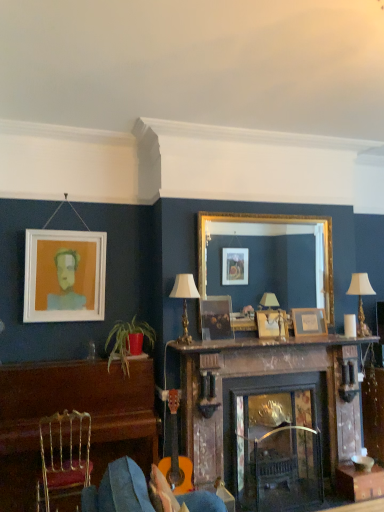
The image size is (384, 512). What do you see at coordinates (270, 223) in the screenshot?
I see `gold-framed mirror at center` at bounding box center [270, 223].

Describe the element at coordinates (184, 301) in the screenshot. I see `gold metallic table lamp at center, the second lamp from the right` at that location.

Locate an element on the screen. The image size is (384, 512). matte white picture frame at left, the first picture frame when ordered from left to right is located at coordinates (64, 276).

What do you see at coordinates (70, 410) in the screenshot? This screenshot has height=512, width=384. I see `brown wooden dresser at left` at bounding box center [70, 410].

You are a GUI agent. You are given a task and a screenshot of the screen. Output one action in this format:
    pyautogui.click(x=<x>, y=<y>)
    Task: Click on the white wax candle at center-right
    This screenshot has width=384, height=512.
    Given the screenshot: What is the action you would take?
    pyautogui.click(x=350, y=326)

The image size is (384, 512). What do you see at coordinates (270, 417) in the screenshot? I see `rustic wood fireplace at center` at bounding box center [270, 417].

This screenshot has height=512, width=384. What are the coordinates of `gold-framed mirror at center` in the screenshot? It's located at (270, 223).

Could you tell me if green leafy plant in red pot at lower left is turned towards wooden table at center?

No, green leafy plant in red pot at lower left is not aimed at wooden table at center.

Which is in front, green leafy plant in red pot at lower left or wooden table at center?

green leafy plant in red pot at lower left.

This screenshot has height=512, width=384. I want to click on houseplant located above the wooden table at center (from a real-world perspective), so click(x=128, y=341).

At what (x,y) coordinates should I click in order to perform the action: click on fireplace below the matte white picture frame at left, placed as the 4th picture frame when sorted from right to left (from the image's perspective). Please return your answer as a coordinate pair (x, y). The image size is (384, 512). Looking at the image, I should click on tap(270, 417).

Looking at the image, does rustic wood fireplace at center seem bigger or smaller compared to matte white picture frame at left, placed as the 4th picture frame when sorted from right to left?

rustic wood fireplace at center is bigger than matte white picture frame at left, placed as the 4th picture frame when sorted from right to left.

Does point (237, 356) lie behind point (33, 249)?

Yes, it is.

Is rustic wood fireplace at center spatially inside matte white picture frame at left, placed as the 4th picture frame when sorted from right to left, or outside of it?

rustic wood fireplace at center lies outside matte white picture frame at left, placed as the 4th picture frame when sorted from right to left.

Considering the sizes of objects white wax candle at center-right and gold-framed mirror at center in the image provided, who is taller, white wax candle at center-right or gold-framed mirror at center?

gold-framed mirror at center.

This screenshot has height=512, width=384. In order to click on mirror in front of the white wax candle at center-right in this screenshot , I will do (270, 223).

From a real-world perspective, is wooden frame at upper center, the 4th picture frame from the left, beneath matte wooden picture frame at center, which is counted as the 2th picture frame, starting from the left?

Yes, from a real-world perspective, wooden frame at upper center, the 4th picture frame from the left, is under matte wooden picture frame at center, which is counted as the 2th picture frame, starting from the left.

Considering the relative sizes of wooden frame at upper center, arranged as the first picture frame when viewed from the right, and matte wooden picture frame at center, which is the third picture frame in right-to-left order, in the image provided, is wooden frame at upper center, arranged as the first picture frame when viewed from the right, taller than matte wooden picture frame at center, which is the third picture frame in right-to-left order,?

Incorrect, the height of wooden frame at upper center, arranged as the first picture frame when viewed from the right, is not larger of that of matte wooden picture frame at center, which is the third picture frame in right-to-left order.

This screenshot has width=384, height=512. I want to click on the 2nd picture frame in front of the wooden frame at upper center, the 4th picture frame from the left, starting your count from the anchor, so click(x=216, y=318).

Which is behind, point (131, 350) or point (216, 327)?

The point (216, 327) is behind.

From the image's perspective, is green leafy plant in red pot at lower left above or below matte wooden picture frame at center, which is counted as the 2th picture frame, starting from the left?

From the image's perspective, green leafy plant in red pot at lower left appears below matte wooden picture frame at center, which is counted as the 2th picture frame, starting from the left.

In terms of size, does green leafy plant in red pot at lower left appear bigger or smaller than matte wooden picture frame at center, which is the third picture frame in right-to-left order?

Considering their sizes, green leafy plant in red pot at lower left takes up more space than matte wooden picture frame at center, which is the third picture frame in right-to-left order.

From a real-world perspective, which picture frame is the 3rd one above the green leafy plant in red pot at lower left? Please provide its 2D coordinates.

[(216, 318)]

Is wooden table at center wider or thinner than wooden picture frame at center, placed as the second picture frame when sorted from right to left?

Considering their sizes, wooden table at center looks broader than wooden picture frame at center, placed as the second picture frame when sorted from right to left.

Where is `table below the wooden picture frame at center, placed as the second picture frame when sorted from right to left (from a real-world perspective)`? The width and height of the screenshot is (384, 512). table below the wooden picture frame at center, placed as the second picture frame when sorted from right to left (from a real-world perspective) is located at coordinates (359, 482).

Considering the positions of objects wooden table at center and wooden picture frame at center, the 3th picture frame viewed from the left, in the image provided, who is more to the left, wooden table at center or wooden picture frame at center, the 3th picture frame viewed from the left,?

wooden picture frame at center, the 3th picture frame viewed from the left, is more to the left.

Does wooden table at center touch wooden picture frame at center, the 3th picture frame viewed from the left?

No, wooden table at center is not next to wooden picture frame at center, the 3th picture frame viewed from the left.

Looking at this image, measure the distance between white wax candle at center-right and marble mantelpiece at center.

white wax candle at center-right is 21.24 inches from marble mantelpiece at center.

Based on their positions, is white wax candle at center-right located to the left or right of marble mantelpiece at center?

white wax candle at center-right is positioned on marble mantelpiece at center's right side.

From a real-world perspective, is white wax candle at center-right on top of marble mantelpiece at center?

Correct, in the physical world, white wax candle at center-right is higher than marble mantelpiece at center.

Is white wax candle at center-right not close to marble mantelpiece at center?

They are positioned close to each other.

Where is `houseplant in front of the wooden table at center`? houseplant in front of the wooden table at center is located at coordinates (128, 341).

The image size is (384, 512). Identify the location of picture frame that is the 4th object above the rustic wood fireplace at center (from a real-world perspective). (64, 276).

Looking at the image, which one is located closer to brown wooden dresser at left, wooden picture frame at center, placed as the second picture frame when sorted from right to left, or gold metallic table lamp at center, which ranks as the second lamp in back-to-front order?

gold metallic table lamp at center, which ranks as the second lamp in back-to-front order.

Based on their spatial positions, is gold-framed mirror at center or marble mantelpiece at center further from wooden frame at upper center, arranged as the first picture frame when viewed from the right?

gold-framed mirror at center lies further to wooden frame at upper center, arranged as the first picture frame when viewed from the right, than the other object.

Considering their positions, is wooden table at center positioned closer to wooden frame at upper center, the 4th picture frame from the left, than matte wooden picture frame at center, which is counted as the 2th picture frame, starting from the left?

Based on the image, matte wooden picture frame at center, which is counted as the 2th picture frame, starting from the left, appears to be nearer to wooden frame at upper center, the 4th picture frame from the left.

Based on their spatial positions, is white fabric lampshade at upper right, positioned as the second lamp in left-to-right order, or rustic wood fireplace at center closer to brown wooden dresser at left?

Among the two, rustic wood fireplace at center is located nearer to brown wooden dresser at left.

When comparing their distances from rustic wood fireplace at center, does wooden frame at upper center, the 4th picture frame from the left, or gold metallic chair at lower left seem closer?

The object closer to rustic wood fireplace at center is wooden frame at upper center, the 4th picture frame from the left.

Looking at the image, which one is located further to matte wooden picture frame at center, which is the third picture frame in right-to-left order, matte white picture frame at left, placed as the 4th picture frame when sorted from right to left, or wooden table at center?

wooden table at center.

Based on their spatial positions, is marble mantelpiece at center or white wax candle at center-right further from rustic wood fireplace at center?

white wax candle at center-right lies further to rustic wood fireplace at center than the other object.

Looking at the image, which one is located further to gold metallic chair at lower left, matte white picture frame at left, placed as the 4th picture frame when sorted from right to left, or white wax candle at center-right?

white wax candle at center-right is positioned further to the anchor gold metallic chair at lower left.

Where is `mirror located between matte white picture frame at left, the first picture frame when ordered from left to right, and white wax candle at center-right in the left-right direction`? The height and width of the screenshot is (512, 384). mirror located between matte white picture frame at left, the first picture frame when ordered from left to right, and white wax candle at center-right in the left-right direction is located at coordinates (270, 223).

The height and width of the screenshot is (512, 384). In order to click on mirror between green leafy plant in red pot at lower left and white fabric lampshade at upper right, the 2th lamp viewed from the front, from left to right in this screenshot , I will do `click(270, 223)`.

Where is `mirror between brown wooden dresser at left and wooden table at center in the horizontal direction`? This screenshot has height=512, width=384. mirror between brown wooden dresser at left and wooden table at center in the horizontal direction is located at coordinates (270, 223).

The height and width of the screenshot is (512, 384). I want to click on lamp located between green leafy plant in red pot at lower left and gold-framed mirror at center in the left-right direction, so click(x=184, y=301).